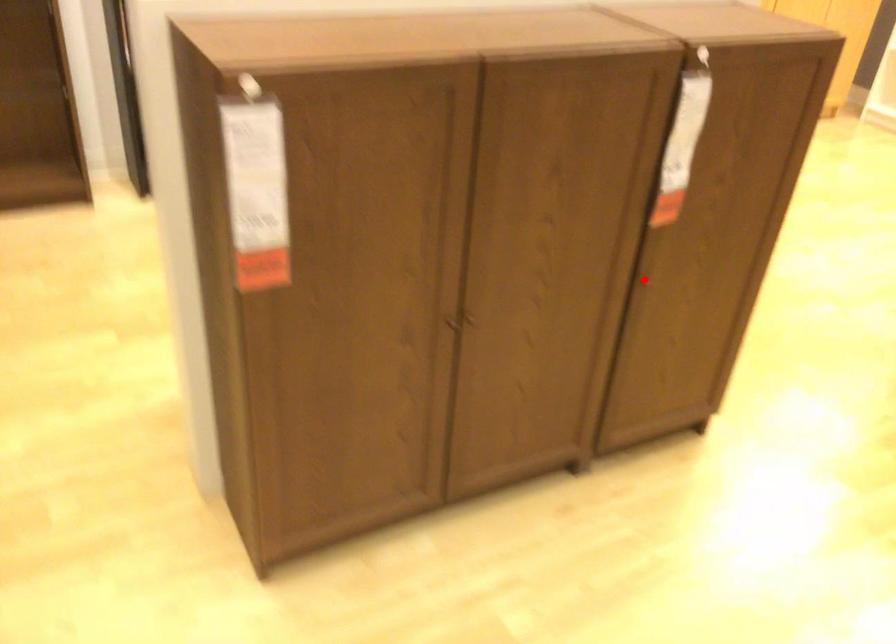
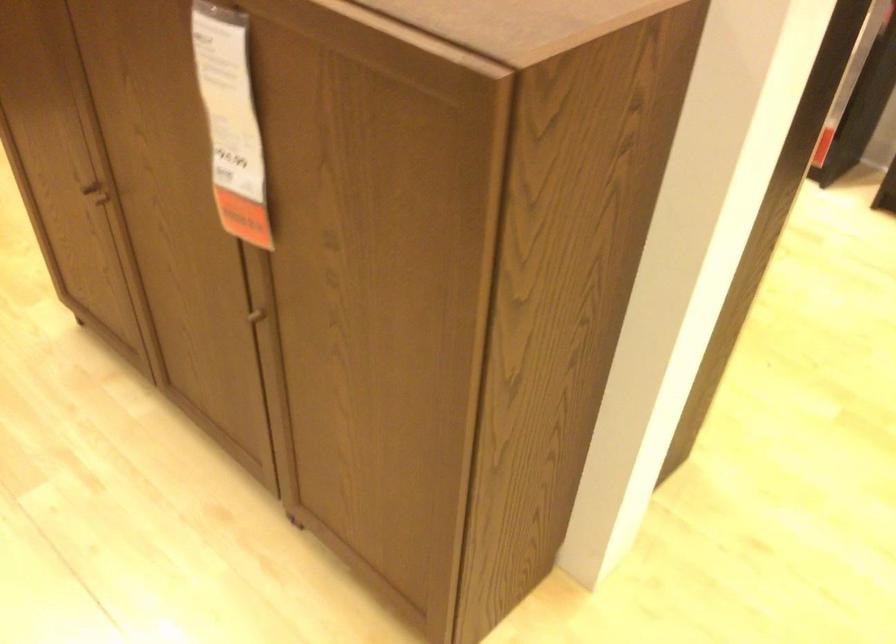
Question: I am providing you with two images of the same scene from different viewpoints. Given a red point in image1, look at the same physical point in image2. Is it:

Choices:
 (A) Closer to the viewpoint
 (B) Farther from the viewpoint

Answer: (A)